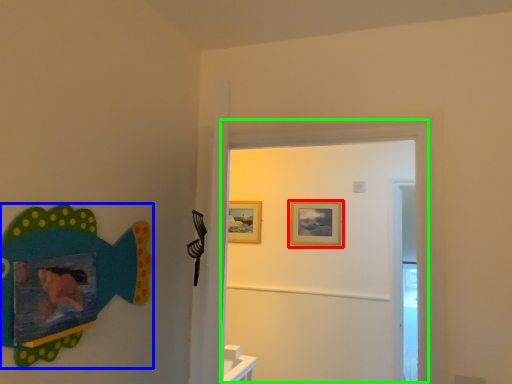
Question: Which object is positioned closest to picture frame (highlighted by a red box)? Select from fish (highlighted by a blue box) and door (highlighted by a green box).

Choices:
 (A) fish
 (B) door

Answer: (B)